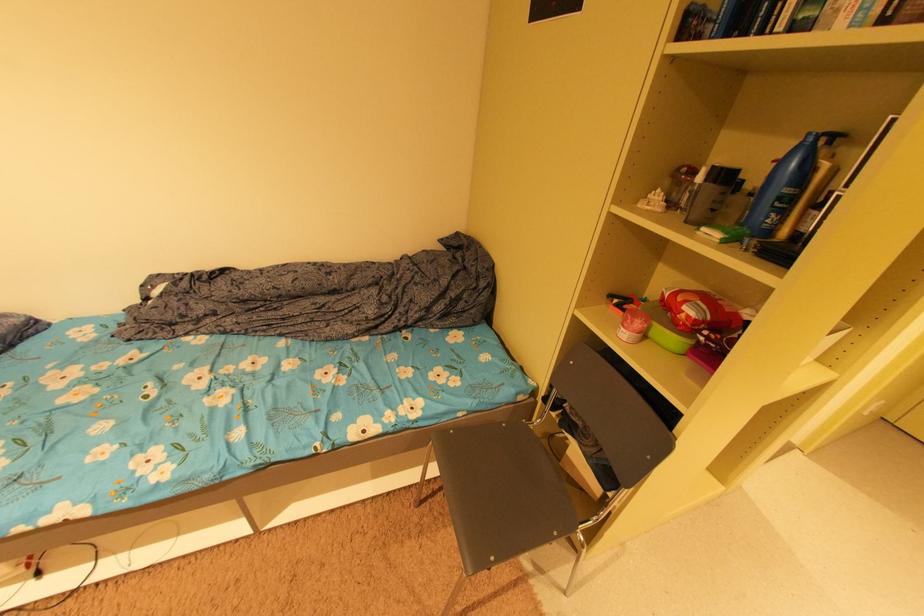
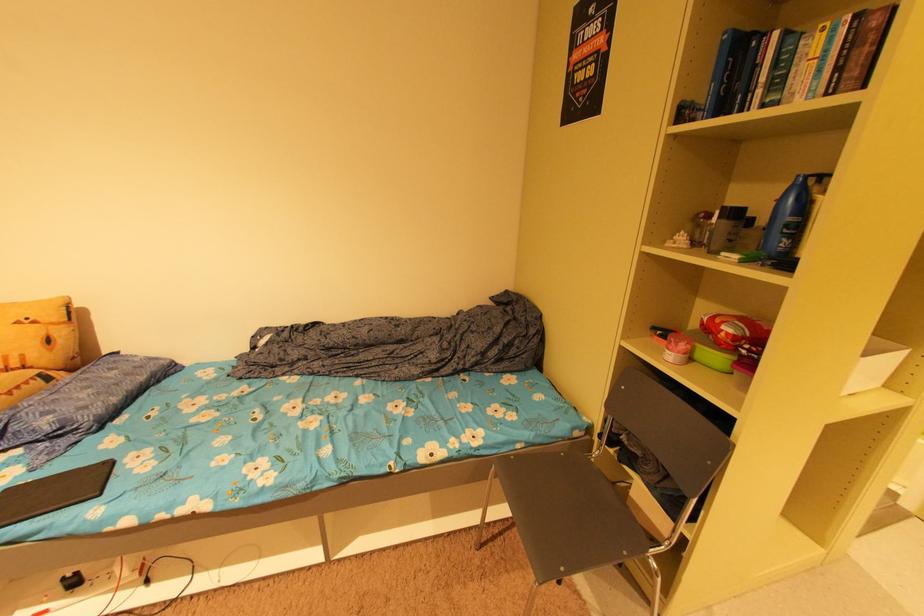
In the second image, find the point that corresponds to (x=629, y=330) in the first image.

(675, 353)